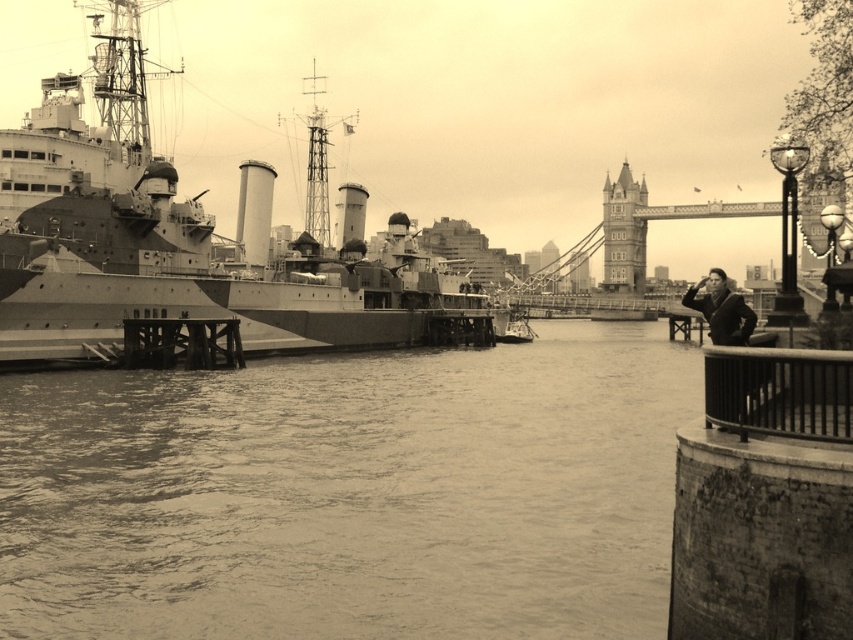
Is point (339, 333) positioned before point (723, 364)?

No, (339, 333) is further to viewer.

Does matte gray ship at left have a smaller size compared to rusty metal railing at lower right?

Incorrect, matte gray ship at left is not smaller in size than rusty metal railing at lower right.

Between point (366, 314) and point (666, 636), which one is positioned in front?

Point (666, 636) is in front.

Locate an element on the screen. matte gray ship at left is located at coordinates (189, 236).

Between matte gray ship at left and smooth black coat at lower right, which one appears on the left side from the viewer's perspective?

matte gray ship at left

Who is positioned more to the right, matte gray ship at left or smooth black coat at lower right?

smooth black coat at lower right is more to the right.

Is point (317, 221) in front of point (712, 296)?

That is False.

The width and height of the screenshot is (853, 640). Identify the location of matte gray ship at left. (189, 236).

Between point (833, 419) and point (634, 291), which one is positioned behind?

Positioned behind is point (634, 291).

Is point (744, 435) in front of point (613, 195)?

Yes, it is.

Identify the location of rusty metal railing at lower right. The height and width of the screenshot is (640, 853). (764, 499).